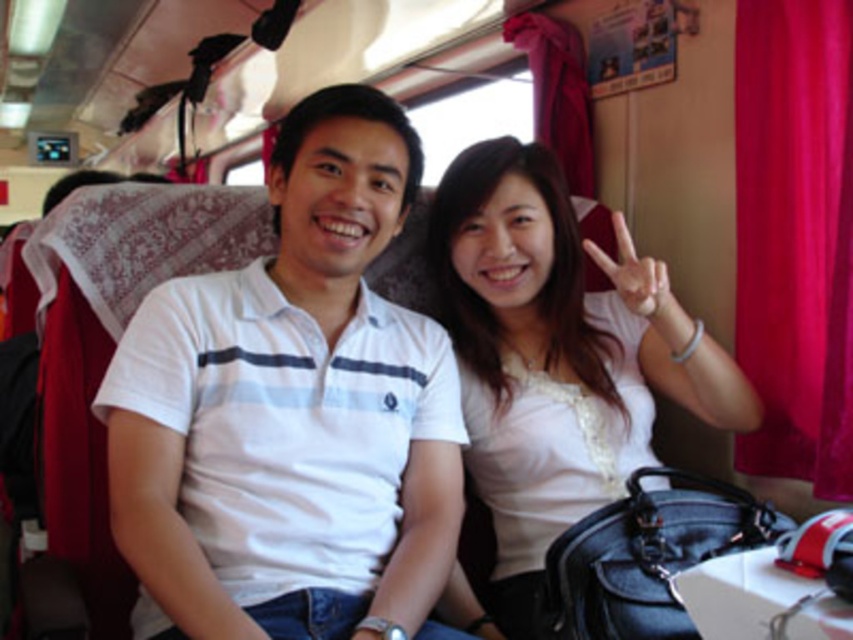
Question: Which object is positioned farthest from the white cotton shirt at center?

Choices:
 (A) white satin blouse at center
 (B) red velvet curtain at right

Answer: (B)

Question: Can you confirm if white satin blouse at center is positioned to the left of red velvet curtain at right?

Choices:
 (A) yes
 (B) no

Answer: (A)

Question: Which point is closer to the camera?

Choices:
 (A) white cotton shirt at center
 (B) red velvet curtain at right

Answer: (A)

Question: Among these points, which one is nearest to the camera?

Choices:
 (A) (584, 252)
 (B) (363, 544)

Answer: (B)

Question: Does white cotton shirt at center appear under red velvet curtain at right?

Choices:
 (A) yes
 (B) no

Answer: (A)

Question: Does white cotton shirt at center lie behind red velvet curtain at right?

Choices:
 (A) yes
 (B) no

Answer: (B)